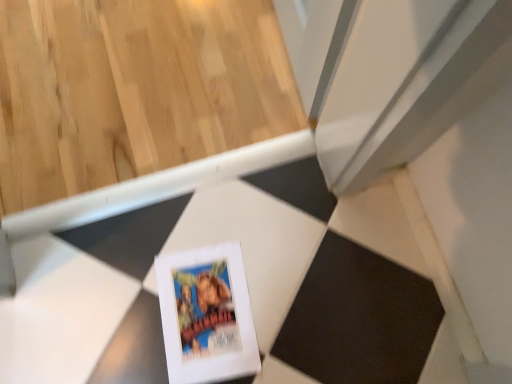
Describe the element at coordinates (206, 315) in the screenshot. I see `white matte picture frame at center` at that location.

Locate an element on the screen. The height and width of the screenshot is (384, 512). white matte picture frame at center is located at coordinates (206, 315).

At what (x,y) coordinates should I click in order to perform the action: click on white matte picture frame at center. Please return your answer as a coordinate pair (x, y). Looking at the image, I should click on (206, 315).